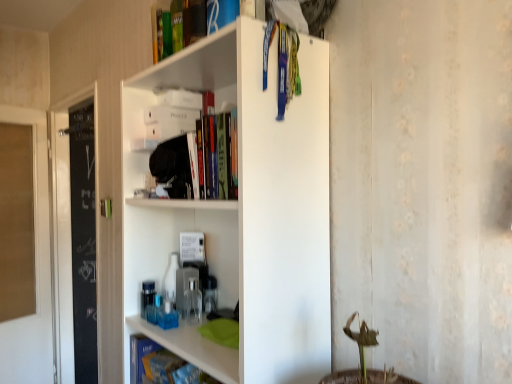
What do you see at coordinates (35, 270) in the screenshot? This screenshot has height=384, width=512. I see `transparent glass door at left` at bounding box center [35, 270].

Measure the distance between blue matte book at lower left, acting as the 1th book starting from the bottom, and camera.

blue matte book at lower left, acting as the 1th book starting from the bottom, and camera are 1.19 meters apart.

Measure the distance between white matte shelf at upper center and camera.

The depth of white matte shelf at upper center is 31.21 inches.

You are a GUI agent. You are given a task and a screenshot of the screen. Output one action in this format:
    pyautogui.click(x=<x>, y=<y>)
    Task: Click on the transparent glass door at left
    
    Given the screenshot: What is the action you would take?
    pyautogui.click(x=35, y=270)

Is transparent glass door at left located within green matte book at upper center, placed as the first book when sorted from top to bottom?

No, transparent glass door at left is not a part of green matte book at upper center, placed as the first book when sorted from top to bottom.

Which object is more forward, green matte book at upper center, the 3th book positioned from the bottom, or transparent glass door at left?

green matte book at upper center, the 3th book positioned from the bottom.

Could you tell me if green matte book at upper center, placed as the first book when sorted from top to bottom, is turned towards transparent glass door at left?

No, green matte book at upper center, placed as the first book when sorted from top to bottom, is not facing towards transparent glass door at left.

From the image's perspective, is blue matte book at lower left, the second book positioned from the top, located above blue matte book at lower left, acting as the 1th book starting from the bottom?

Yes, from the image's perspective, blue matte book at lower left, the second book positioned from the top, is on top of blue matte book at lower left, acting as the 1th book starting from the bottom.

Is blue matte book at lower left, which is counted as the second book, starting from the bottom, facing away from blue matte book at lower left, acting as the 1th book starting from the bottom?

No, blue matte book at lower left, acting as the 1th book starting from the bottom, is not at the back of blue matte book at lower left, which is counted as the second book, starting from the bottom.

Relative to blue matte book at lower left, positioned as the 3th book in top-to-bottom order, is blue matte book at lower left, which is counted as the second book, starting from the bottom, in front or behind?

Clearly, blue matte book at lower left, which is counted as the second book, starting from the bottom, is in front of blue matte book at lower left, positioned as the 3th book in top-to-bottom order.

Is blue matte book at lower left, positioned as the 3th book in top-to-bottom order, far away from white matte shelf at upper center?

No, blue matte book at lower left, positioned as the 3th book in top-to-bottom order, is in close proximity to white matte shelf at upper center.

From the picture: From a real-world perspective, which object rests below the other?

In real-world perspective, blue matte book at lower left, acting as the 1th book starting from the bottom, is lower.

Is blue matte book at lower left, positioned as the 3th book in top-to-bottom order, smaller than white matte shelf at upper center?

Indeed, blue matte book at lower left, positioned as the 3th book in top-to-bottom order, has a smaller size compared to white matte shelf at upper center.

Based on the photo, considering the relative sizes of green matte book at upper center, placed as the first book when sorted from top to bottom, and blue matte book at lower left, positioned as the 3th book in top-to-bottom order, in the image provided, is green matte book at upper center, placed as the first book when sorted from top to bottom, shorter than blue matte book at lower left, positioned as the 3th book in top-to-bottom order,?

Indeed, green matte book at upper center, placed as the first book when sorted from top to bottom, has a lesser height compared to blue matte book at lower left, positioned as the 3th book in top-to-bottom order.

Considering the relative sizes of green matte book at upper center, placed as the first book when sorted from top to bottom, and blue matte book at lower left, positioned as the 3th book in top-to-bottom order, in the image provided, is green matte book at upper center, placed as the first book when sorted from top to bottom, thinner than blue matte book at lower left, positioned as the 3th book in top-to-bottom order,?

No.

Between green matte book at upper center, placed as the first book when sorted from top to bottom, and blue matte book at lower left, positioned as the 3th book in top-to-bottom order, which one has larger size?

green matte book at upper center, placed as the first book when sorted from top to bottom, is bigger.

Does green matte book at upper center, the 3th book positioned from the bottom, appear on the left side of blue matte book at lower left, acting as the 1th book starting from the bottom?

No.

Could you tell me if blue matte book at lower left, the second book positioned from the top, is turned towards transparent glass door at left?

No.

Would you say blue matte book at lower left, the second book positioned from the top, is inside or outside transparent glass door at left?

blue matte book at lower left, the second book positioned from the top, is outside transparent glass door at left.

Considering the relative positions of blue matte book at lower left, the second book positioned from the top, and transparent glass door at left in the image provided, is blue matte book at lower left, the second book positioned from the top, in front of transparent glass door at left?

Yes, it is in front of transparent glass door at left.

How much distance is there between blue matte book at lower left, the second book positioned from the top, and transparent glass door at left?

blue matte book at lower left, the second book positioned from the top, and transparent glass door at left are 6.17 feet apart.

Is green matte book at upper center, placed as the first book when sorted from top to bottom, not inside blue matte book at lower left, which is counted as the second book, starting from the bottom?

Absolutely, green matte book at upper center, placed as the first book when sorted from top to bottom, is external to blue matte book at lower left, which is counted as the second book, starting from the bottom.

Considering the points (164, 41) and (193, 366), which point is in front, point (164, 41) or point (193, 366)?

Point (193, 366)

Is green matte book at upper center, placed as the first book when sorted from top to bottom, aimed at blue matte book at lower left, which is counted as the second book, starting from the bottom?

No, green matte book at upper center, placed as the first book when sorted from top to bottom, is not turned towards blue matte book at lower left, which is counted as the second book, starting from the bottom.

Does green matte book at upper center, placed as the first book when sorted from top to bottom, have a greater height compared to blue matte book at lower left, which is counted as the second book, starting from the bottom?

Yes.

Looking at this image, are blue matte book at lower left, the second book positioned from the top, and white matte shelf at upper center making contact?

blue matte book at lower left, the second book positioned from the top, and white matte shelf at upper center are clearly separated.

Is blue matte book at lower left, the second book positioned from the top, taller or shorter than white matte shelf at upper center?

Considering their sizes, blue matte book at lower left, the second book positioned from the top, has less height than white matte shelf at upper center.

Consider the image. From the image's perspective, would you say blue matte book at lower left, the second book positioned from the top, is shown under white matte shelf at upper center?

Correct, blue matte book at lower left, the second book positioned from the top, appears lower than white matte shelf at upper center in the image.

From a real-world perspective, which object stands above the other?

white matte shelf at upper center, from a real-world perspective.

Starting from the transparent glass door at left, which book is the 3rd one to the right? Please provide its 2D coordinates.

[(177, 27)]

From a real-world perspective, count 1st books upward from the blue matte book at lower left, acting as the 1th book starting from the bottom, and point to it. Please provide its 2D coordinates.

[(160, 364)]

Considering their positions, is blue matte book at lower left, the second book positioned from the top, positioned further to transparent glass door at left than blue matte book at lower left, positioned as the 3th book in top-to-bottom order?

blue matte book at lower left, the second book positioned from the top, is further to transparent glass door at left.

When comparing their distances from blue matte book at lower left, which is counted as the second book, starting from the bottom, does blue matte book at lower left, positioned as the 3th book in top-to-bottom order, or transparent glass door at left seem closer?

Based on the image, blue matte book at lower left, positioned as the 3th book in top-to-bottom order, appears to be nearer to blue matte book at lower left, which is counted as the second book, starting from the bottom.

When comparing their distances from green matte book at upper center, placed as the first book when sorted from top to bottom, does blue matte book at lower left, positioned as the 3th book in top-to-bottom order, or blue matte book at lower left, which is counted as the second book, starting from the bottom, seem closer?

Based on the image, blue matte book at lower left, which is counted as the second book, starting from the bottom, appears to be nearer to green matte book at upper center, placed as the first book when sorted from top to bottom.

Which object lies nearer to the anchor point green matte book at upper center, the 3th book positioned from the bottom, transparent glass door at left or white matte shelf at upper center?

white matte shelf at upper center.

From the image, which object appears to be nearer to blue matte book at lower left, the second book positioned from the top, green matte book at upper center, the 3th book positioned from the bottom, or white matte shelf at upper center?

white matte shelf at upper center is closer to blue matte book at lower left, the second book positioned from the top.

Based on their spatial positions, is transparent glass door at left or blue matte book at lower left, acting as the 1th book starting from the bottom, closer to white matte shelf at upper center?

blue matte book at lower left, acting as the 1th book starting from the bottom, is closer to white matte shelf at upper center.

Which object lies further to the anchor point green matte book at upper center, placed as the first book when sorted from top to bottom, white matte shelf at upper center or transparent glass door at left?

Among the two, transparent glass door at left is located further to green matte book at upper center, placed as the first book when sorted from top to bottom.

Looking at the image, which one is located further to blue matte book at lower left, positioned as the 3th book in top-to-bottom order, transparent glass door at left or white matte shelf at upper center?

transparent glass door at left is further to blue matte book at lower left, positioned as the 3th book in top-to-bottom order.

Identify the location of shelf that lies between green matte book at upper center, the 3th book positioned from the bottom, and blue matte book at lower left, which is counted as the second book, starting from the bottom, from top to bottom. (240, 207).

Find the location of a particular element. Image resolution: width=512 pixels, height=384 pixels. shelf between green matte book at upper center, placed as the first book when sorted from top to bottom, and blue matte book at lower left, acting as the 1th book starting from the bottom, in the vertical direction is located at coordinates (240, 207).

Find the location of `book between green matte book at upper center, the 3th book positioned from the bottom, and blue matte book at lower left, acting as the 1th book starting from the bottom, in the vertical direction`. book between green matte book at upper center, the 3th book positioned from the bottom, and blue matte book at lower left, acting as the 1th book starting from the bottom, in the vertical direction is located at coordinates (160, 364).

This screenshot has width=512, height=384. In order to click on book between blue matte book at lower left, which is counted as the second book, starting from the bottom, and transparent glass door at left from front to back in this screenshot , I will do `click(140, 355)`.